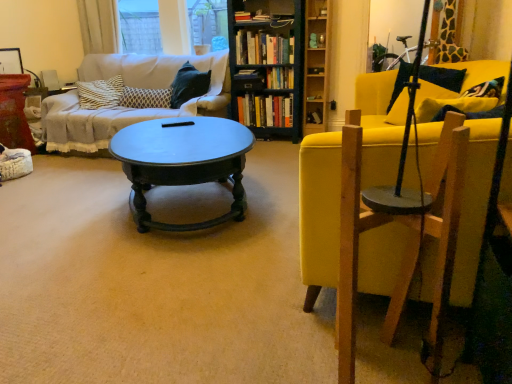
Where is `vacant region under wooden swivel chair at right (from a real-world perspective)`? Image resolution: width=512 pixels, height=384 pixels. vacant region under wooden swivel chair at right (from a real-world perspective) is located at coordinates (388, 357).